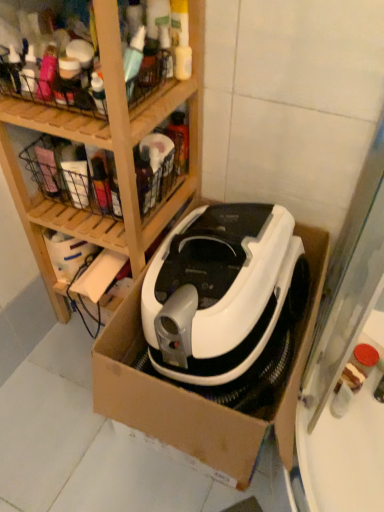
Where is `vacant point above metallic wire basket at upper left (from a real-world perspective)`? vacant point above metallic wire basket at upper left (from a real-world perspective) is located at coordinates (61, 53).